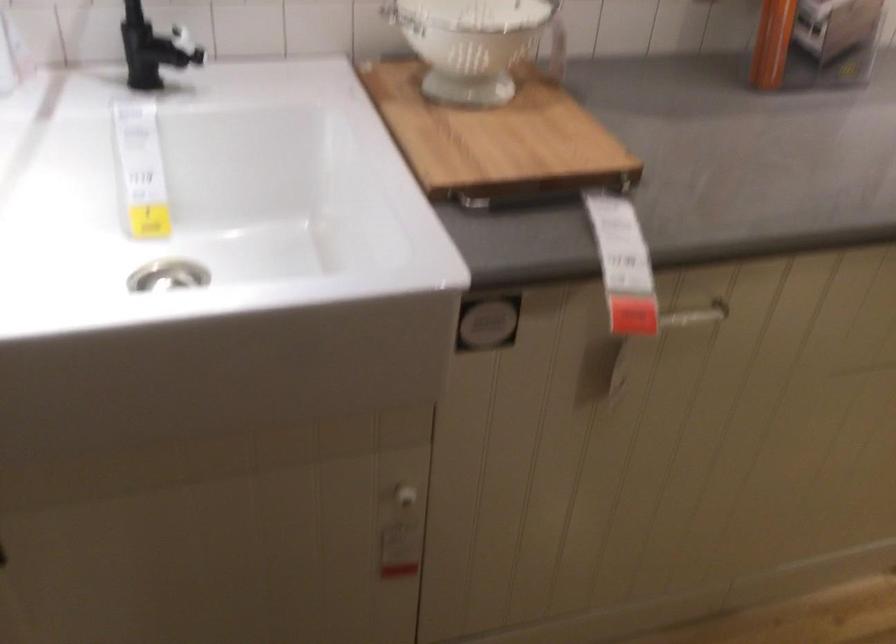
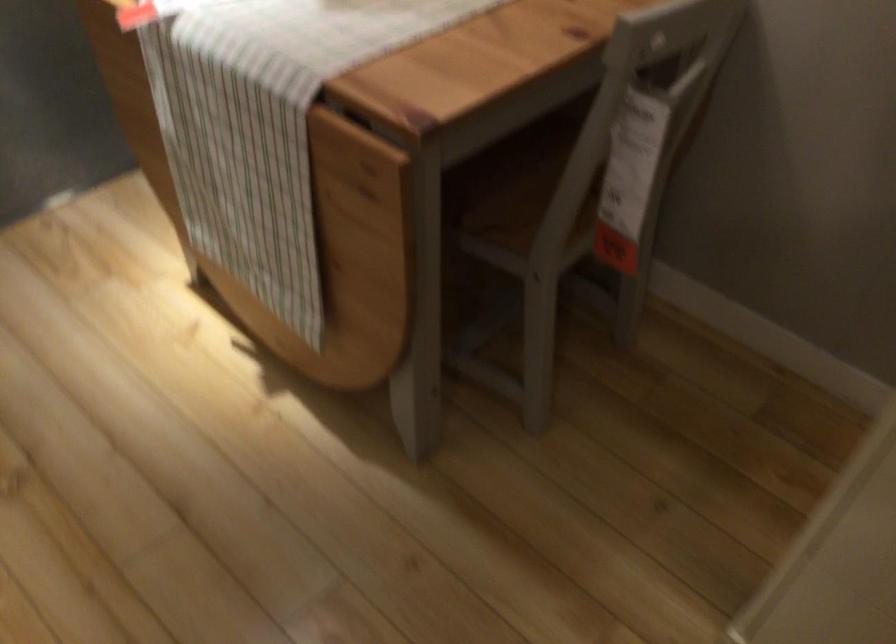
The images are taken continuously from a first-person perspective. In which direction is your viewpoint rotating?

The camera rotated toward right-down.